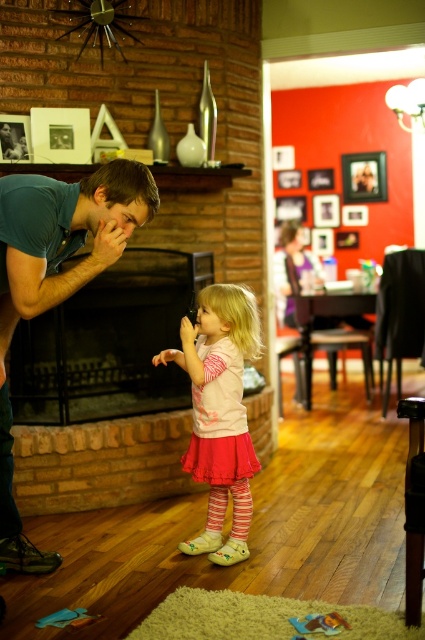
Question: Can you confirm if wooden picture frame at upper center is positioned to the right of metallic silver picture frame at upper left?

Choices:
 (A) yes
 (B) no

Answer: (A)

Question: Estimate the real-world distances between objects in this image. Which object is closer to the black metal fireplace at left?

Choices:
 (A) wooden picture frame at upper center
 (B) metallic silver picture frame at upper left
 (C) teal cotton shirt at left
 (D) matte pink skirt at center

Answer: (D)

Question: Does teal cotton shirt at left come behind metallic silver picture frame at upper left?

Choices:
 (A) yes
 (B) no

Answer: (B)

Question: Which point is farther to the camera?

Choices:
 (A) black metal fireplace at left
 (B) wooden picture frame at upper center
 (C) teal cotton shirt at left

Answer: (B)

Question: Estimate the real-world distances between objects in this image. Which object is closer to the wooden picture frame at upper center?

Choices:
 (A) metallic silver picture frame at upper left
 (B) teal cotton shirt at left
 (C) black metal fireplace at left
 (D) matte pink skirt at center

Answer: (C)

Question: Is teal cotton shirt at left positioned behind matte pink skirt at center?

Choices:
 (A) no
 (B) yes

Answer: (A)